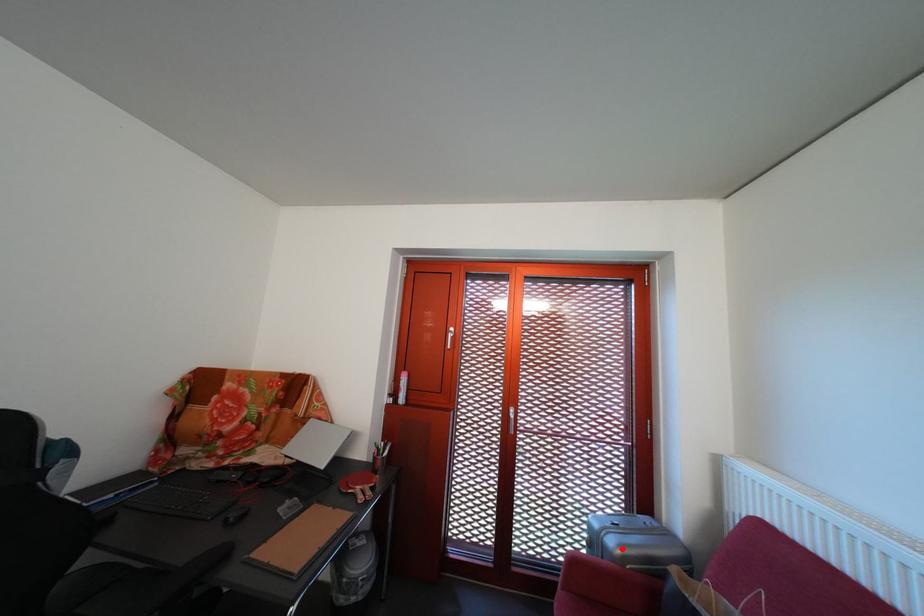
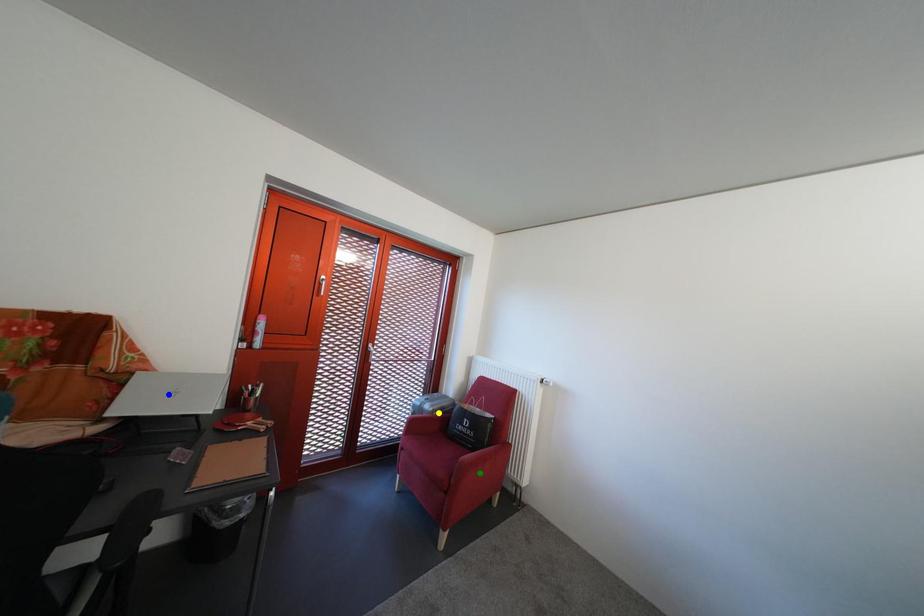
Question: I am providing you with two images of the same scene from different viewpoints. A red point is marked on the first image. You are given multiple points on the second image. Which spot in image 2 lines up with the point in image 1?

Choices:
 (A) blue point
 (B) yellow point
 (C) green point

Answer: (B)